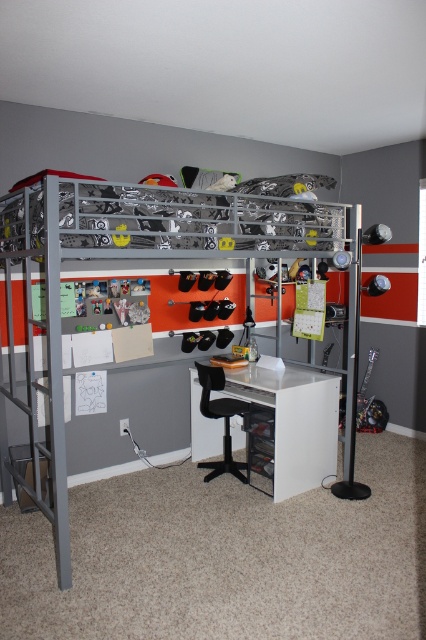
You are a person who wants to move a small plant from the desk to the floor. Can you place the plant directly below the white glossy desk at center without it being under the black plastic stool at lower center?

The white glossy desk at center is positioned over the black plastic stool at lower center. Since the stool is already under the desk, placing the plant directly below the desk would mean placing it under the stool as well, so it won not be possible to place the plant directly below the desk without it being under the stool.

You are a delivery person who needs to place a package on the desk between the metallic silver bunk bed at upper center and the black plastic stool at lower center. The package is 1.2 meters long. Can you fit the package horizontally on the desk without it hanging off the edge?

The metallic silver bunk bed at upper center is 1.17 meters from the black plastic stool at lower center, so the desk is likely shorter than 1.2 meters. Therefore, the package cannot be placed horizontally without overhanging the desk.

You are a student who needs to sit at the white glossy desk at center to study. You have a 1.5 meter tall backpack that you want to place under the desk. Can the backpack fit under the desk if the distance between the desk and the floor is equal to the height of the black plastic stool at lower center?

The white glossy desk at center has a greater height compared to the black plastic stool at lower center. Since the backpack is 1.5 meters tall, and the space under the desk is only as tall as the stool, which is shorter than the desk, the backpack likely cannot fit under the desk.